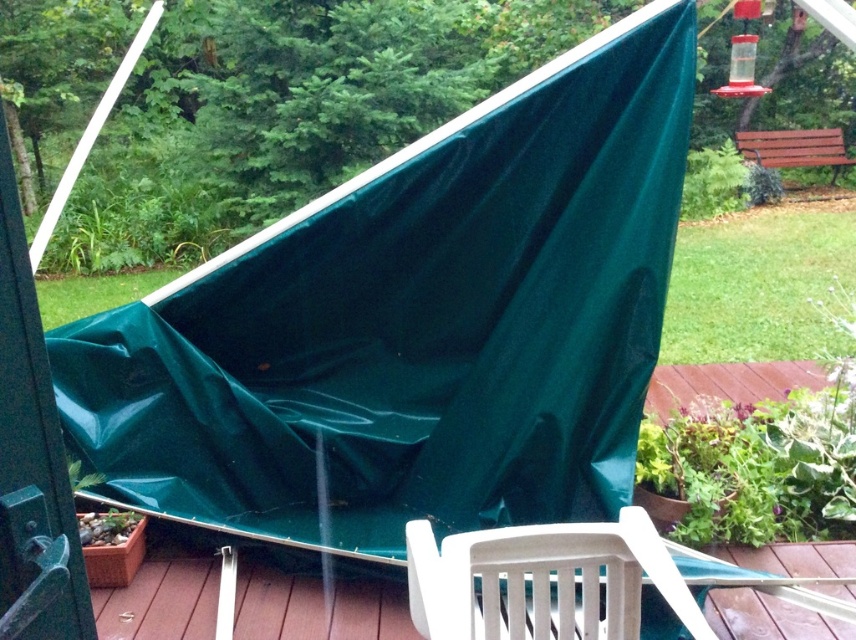
Question: Estimate the real-world distances between objects in this image. Which object is farther from the white plastic chair at lower center?

Choices:
 (A) green tarp at upper center
 (B) green tarp at left
 (C) brown wood deck at lower center

Answer: (C)

Question: Does green tarp at upper center appear on the left side of white plastic chair at lower center?

Choices:
 (A) yes
 (B) no

Answer: (A)

Question: Which object appears farthest from the camera in this image?

Choices:
 (A) white plastic chair at lower center
 (B) brown wood deck at lower center
 (C) green tarp at upper center
 (D) green tarp at left

Answer: (B)

Question: Which point appears farthest from the camera in this image?

Choices:
 (A) (560, 582)
 (B) (15, 444)
 (C) (198, 621)

Answer: (C)

Question: Does green tarp at upper center appear under brown wood deck at lower center?

Choices:
 (A) no
 (B) yes

Answer: (A)

Question: Can you confirm if green tarp at upper center is positioned to the left of green tarp at left?

Choices:
 (A) yes
 (B) no

Answer: (B)